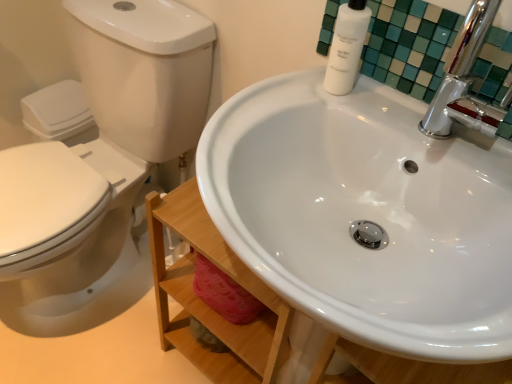
I want to click on white glossy toilet at left, so [101, 166].

Where is `white glossy sink at center`? The width and height of the screenshot is (512, 384). white glossy sink at center is located at coordinates [366, 215].

The height and width of the screenshot is (384, 512). In order to click on white glossy bottle at upper right in this screenshot , I will do `click(409, 45)`.

Identify the location of white glossy toilet at left. This screenshot has height=384, width=512. (101, 166).

Is the surface of white glossy toilet at left in direct contact with white matte bottle at upper right?

No, white glossy toilet at left is not with white matte bottle at upper right.

Is point (161, 160) positioned before point (350, 12)?

No.

How much distance is there between white glossy toilet at left and white matte bottle at upper right?

The distance of white glossy toilet at left from white matte bottle at upper right is 25.76 inches.

Based on their sizes in the image, would you say white glossy toilet at left is bigger or smaller than white matte bottle at upper right?

In the image, white glossy toilet at left appears to be larger than white matte bottle at upper right.

I want to click on sink in front of the white glossy toilet at left, so click(366, 215).

Does point (347, 240) lie behind point (81, 252)?

That is False.

Considering the sizes of white glossy sink at center and white glossy toilet at left in the image, is white glossy sink at center taller or shorter than white glossy toilet at left?

Considering their sizes, white glossy sink at center has less height than white glossy toilet at left.

Is white glossy sink at center aimed at white glossy toilet at left?

No, white glossy sink at center is not turned towards white glossy toilet at left.

From the picture: Does white glossy toilet at left touch white glossy bottle at upper right?

No, white glossy toilet at left is not touching white glossy bottle at upper right.

Is white glossy toilet at left wider or thinner than white glossy bottle at upper right?

Clearly, white glossy toilet at left has more width compared to white glossy bottle at upper right.

Choose the correct answer: Is white glossy toilet at left inside white glossy bottle at upper right or outside it?

The correct answer is: outside.

From the image's perspective, relative to white glossy bottle at upper right, is white glossy toilet at left above or below?

Clearly, from the image's perspective, white glossy toilet at left is below white glossy bottle at upper right.

You are a GUI agent. You are given a task and a screenshot of the screen. Output one action in this format:
    pyautogui.click(x=<x>, y=<y>)
    Task: Click on the mirror that appears above the white glossy sink at center (from the image's perspective)
    Image resolution: width=512 pixels, height=384 pixels.
    Given the screenshot: What is the action you would take?
    pyautogui.click(x=409, y=45)

Is white glossy sink at center located outside white glossy bottle at upper right?

white glossy sink at center is positioned outside white glossy bottle at upper right.

Considering the relative sizes of white glossy sink at center and white glossy bottle at upper right in the image provided, is white glossy sink at center taller than white glossy bottle at upper right?

Correct, white glossy sink at center is much taller as white glossy bottle at upper right.

Is white glossy sink at center far from white glossy bottle at upper right?

No, white glossy sink at center is not far from white glossy bottle at upper right.

From a real-world perspective, which is physically below, white glossy bottle at upper right or white glossy sink at center?

white glossy sink at center is physically lower.

In the scene shown: Choose the correct answer: Is white glossy bottle at upper right inside white glossy sink at center or outside it?

The correct answer is: outside.

Based on their sizes in the image, would you say white glossy bottle at upper right is bigger or smaller than white glossy sink at center?

Clearly, white glossy bottle at upper right is smaller in size than white glossy sink at center.

Looking at this image, from the image's perspective, is white glossy bottle at upper right located above white glossy sink at center?

Yes, from the image's perspective, white glossy bottle at upper right is on top of white glossy sink at center.

Based on the photo, considering the positions of objects white matte bottle at upper right and white glossy toilet at left in the image provided, who is in front, white matte bottle at upper right or white glossy toilet at left?

white glossy toilet at left is closer to the camera.

Who is shorter, white matte bottle at upper right or white glossy toilet at left?

white matte bottle at upper right is shorter.

Which is nearer, (360, 21) or (167, 1)?

Point (360, 21) appears to be closer to the viewer than point (167, 1).

Can we say white matte bottle at upper right lies outside white glossy sink at center?

Indeed, white matte bottle at upper right is completely outside white glossy sink at center.

Considering the sizes of objects white matte bottle at upper right and white glossy sink at center in the image provided, who is wider, white matte bottle at upper right or white glossy sink at center?

With larger width is white glossy sink at center.

Based on the photo, which object is further away from the camera, white matte bottle at upper right or white glossy sink at center?

Positioned behind is white matte bottle at upper right.

Identify the location of toiletry above the white glossy toilet at left (from the image's perspective). (346, 47).

Find the location of `sink below the white glossy toilet at left (from the image's perspective)`. sink below the white glossy toilet at left (from the image's perspective) is located at coordinates (366, 215).

Which object lies further to the anchor point white glossy toilet at left, white glossy sink at center or white matte bottle at upper right?

Based on the image, white matte bottle at upper right appears to be further to white glossy toilet at left.

Looking at the image, which one is located further to white matte bottle at upper right, white glossy bottle at upper right or white glossy toilet at left?

The object further to white matte bottle at upper right is white glossy toilet at left.

When comparing their distances from white glossy toilet at left, does white matte bottle at upper right or white glossy sink at center seem further?

The object further to white glossy toilet at left is white matte bottle at upper right.

When comparing their distances from white matte bottle at upper right, does white glossy sink at center or white glossy bottle at upper right seem closer?

white glossy bottle at upper right.

When comparing their distances from white matte bottle at upper right, does white glossy bottle at upper right or white glossy sink at center seem closer?

The object closer to white matte bottle at upper right is white glossy bottle at upper right.

Based on their spatial positions, is white matte bottle at upper right or white glossy bottle at upper right closer to white glossy toilet at left?

Based on the image, white glossy bottle at upper right appears to be nearer to white glossy toilet at left.

Which object lies nearer to the anchor point white glossy bottle at upper right, white glossy toilet at left or white glossy sink at center?

Based on the image, white glossy sink at center appears to be nearer to white glossy bottle at upper right.

Looking at this image, considering their positions, is white glossy sink at center positioned further to white glossy bottle at upper right than white glossy toilet at left?

white glossy toilet at left is positioned further to the anchor white glossy bottle at upper right.

Find the location of `sink between white glossy toilet at left and white matte bottle at upper right in the horizontal direction`. sink between white glossy toilet at left and white matte bottle at upper right in the horizontal direction is located at coordinates (366, 215).

Locate an element on the screen. Image resolution: width=512 pixels, height=384 pixels. mirror between white matte bottle at upper right and white glossy sink at center from top to bottom is located at coordinates (409, 45).

Identify the location of sink between white glossy toilet at left and white glossy bottle at upper right from left to right. (366, 215).

The height and width of the screenshot is (384, 512). In order to click on toiletry between white glossy toilet at left and white glossy bottle at upper right from left to right in this screenshot , I will do `click(346, 47)`.